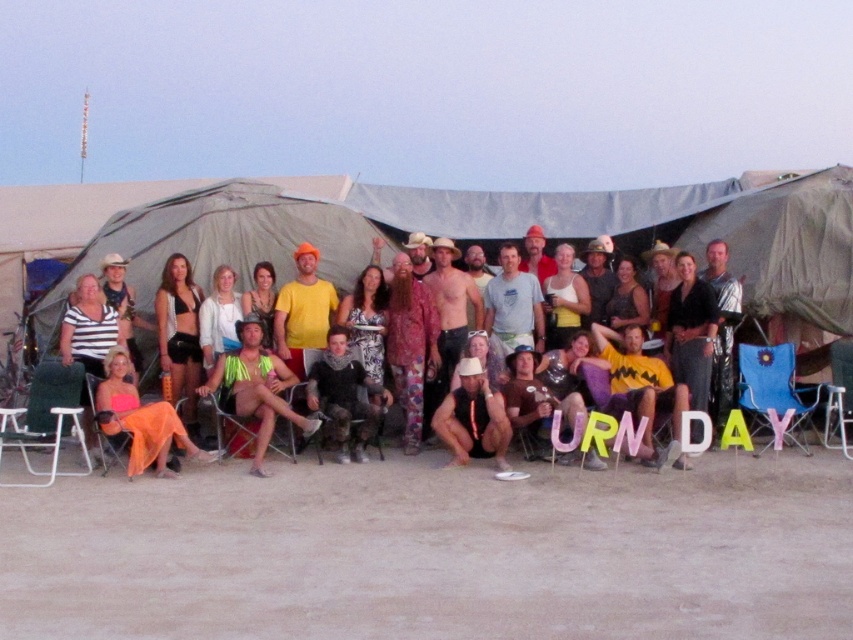
Question: Is green canvas tent at center smaller than matte black shirt at center?

Choices:
 (A) no
 (B) yes

Answer: (A)

Question: Does smooth sand at lower center lie behind neon green fabric at center?

Choices:
 (A) no
 (B) yes

Answer: (A)

Question: Which of the following is the closest to the observer?

Choices:
 (A) (583, 372)
 (B) (763, 365)
 (C) (183, 408)
 (D) (376, 397)

Answer: (D)

Question: Which point is closer to the camera?

Choices:
 (A) flannel shirt at center
 (B) blue fabric beach chair at lower right

Answer: (A)

Question: Which of the following is the farthest from the observer?

Choices:
 (A) neon green fabric at center
 (B) green fabric beach chair at lower left

Answer: (A)

Question: Does smooth sand at lower center have a lesser width compared to flannel shirt at center?

Choices:
 (A) yes
 (B) no

Answer: (B)